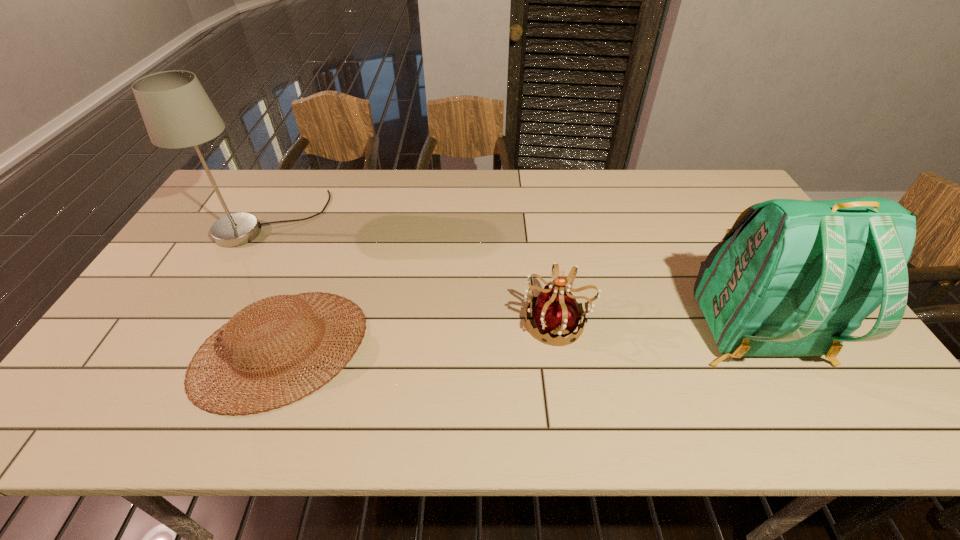
Where is `the farthest object`? the farthest object is located at coordinates (177, 112).

Find the location of a particular element. The height and width of the screenshot is (540, 960). backpack is located at coordinates (791, 277).

I want to click on tiara, so click(x=556, y=312).

The width and height of the screenshot is (960, 540). I want to click on the second shortest object, so click(556, 312).

The width and height of the screenshot is (960, 540). I want to click on sunhat, so click(x=240, y=325).

The width and height of the screenshot is (960, 540). I want to click on vacant area situated 0.320m on the front of the farthest object, so click(206, 337).

Identify the location of free space located 0.180m on the front-facing side of the second shortest object. The width and height of the screenshot is (960, 540). (452, 322).

You are a GUI agent. You are given a task and a screenshot of the screen. Output one action in this format:
    pyautogui.click(x=<x>, y=<y>)
    Task: Click on the vacant space located on the front-facing side of the second shortest object
    
    Given the screenshot: What is the action you would take?
    pyautogui.click(x=371, y=322)

Identify the location of blank space located on the front-facing side of the second shortest object. The image size is (960, 540). (401, 322).

Locate an element on the screen. free space located on the back of the sunhat is located at coordinates (328, 225).